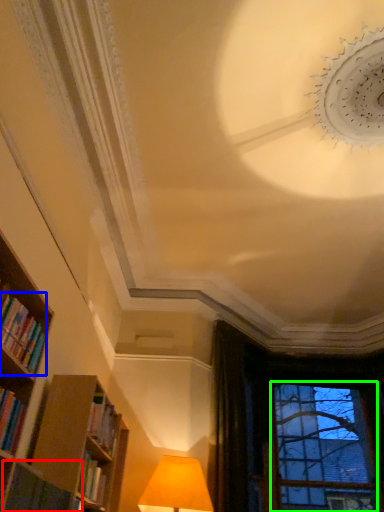
Question: Which is nearer to the book (highlighted by a red box)? book (highlighted by a blue box) or bay window (highlighted by a green box).

Choices:
 (A) book
 (B) bay window

Answer: (A)